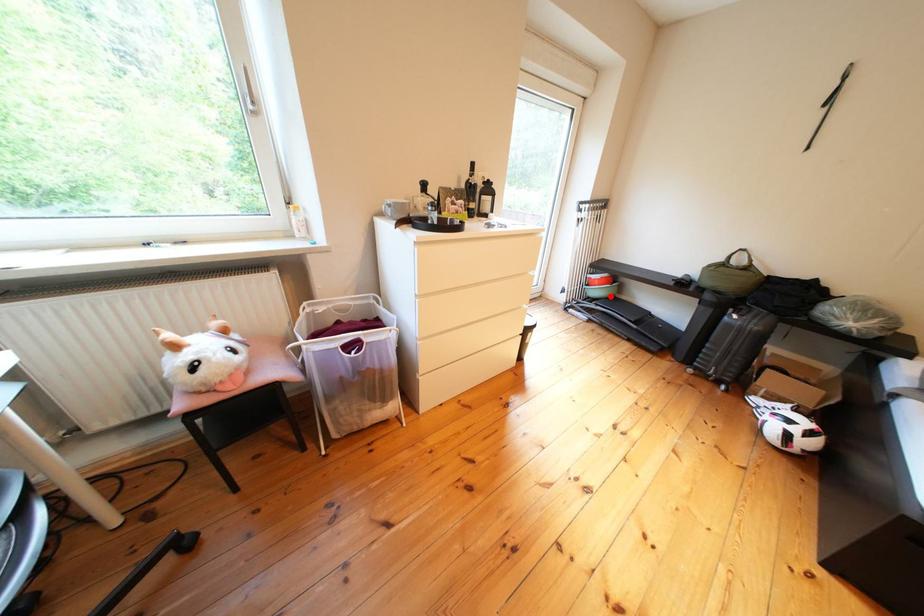
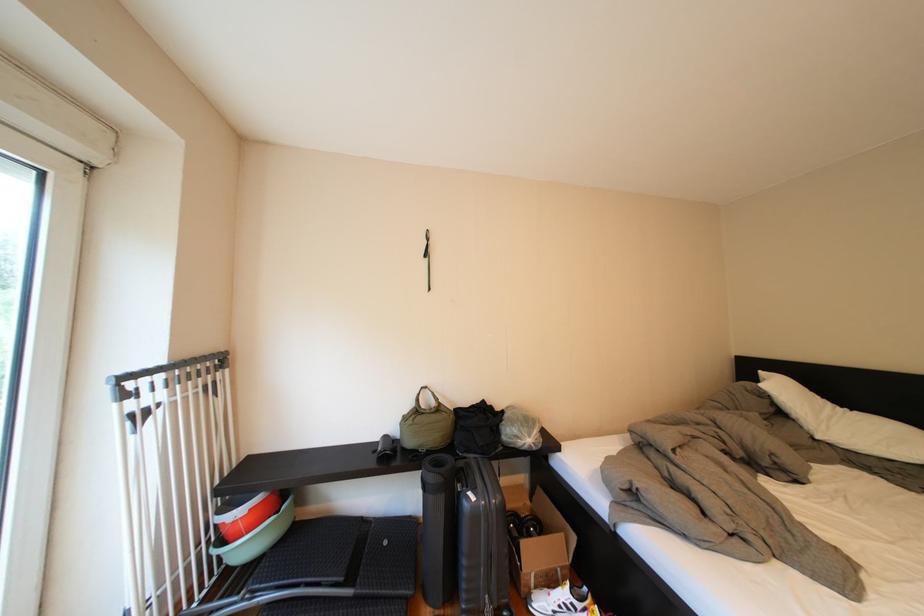
Find the pixel in the second image that matches the highlighted location in the first image.

(261, 551)